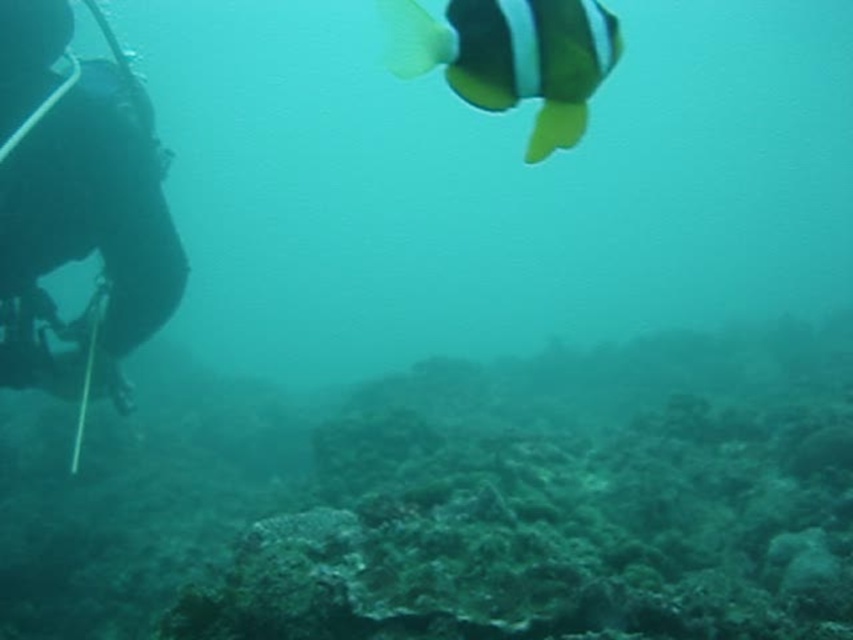
Question: Can you confirm if green mossy coral reef at center is positioned to the left of black matte fish at upper center?

Choices:
 (A) no
 (B) yes

Answer: (B)

Question: Which object is closer to the camera taking this photo?

Choices:
 (A) black rubber wetsuit at left
 (B) green mossy coral reef at center

Answer: (B)

Question: Is green mossy coral reef at center wider than black rubber wetsuit at left?

Choices:
 (A) no
 (B) yes

Answer: (B)

Question: Does green mossy coral reef at center have a larger size compared to black matte fish at upper center?

Choices:
 (A) yes
 (B) no

Answer: (A)

Question: Estimate the real-world distances between objects in this image. Which object is closer to the green mossy coral reef at center?

Choices:
 (A) black rubber wetsuit at left
 (B) black matte fish at upper center

Answer: (A)

Question: Which point is farther to the camera?

Choices:
 (A) green mossy coral reef at center
 (B) black rubber wetsuit at left
 (C) black matte fish at upper center

Answer: (B)